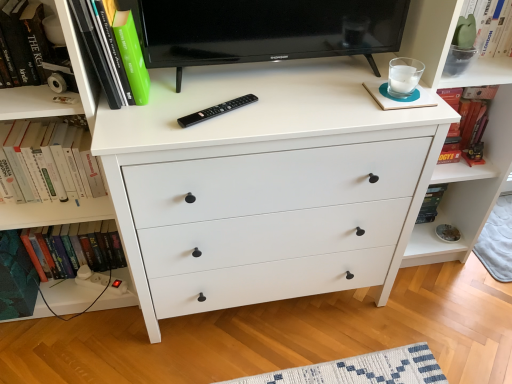
Find the location of a particular element. This screenshot has height=384, width=512. empty space that is to the right of white matte chest of drawers at center is located at coordinates pyautogui.click(x=426, y=322).